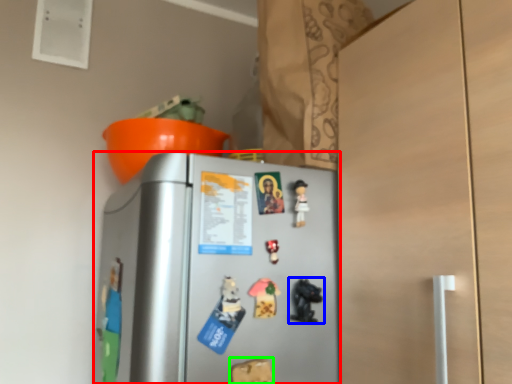
Question: Which object is positioned farthest from refrigerator (highlighted by a red box)? Select from toy (highlighted by a blue box) and toy (highlighted by a green box).

Choices:
 (A) toy
 (B) toy

Answer: (B)